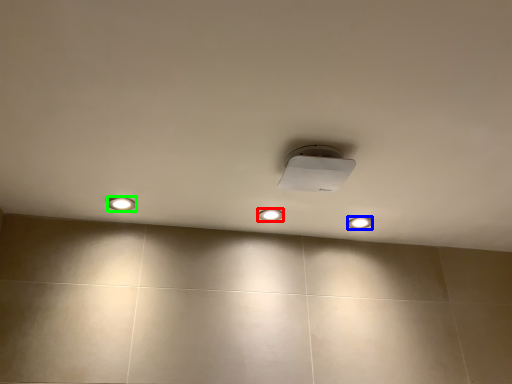
Question: Which object is the closest to the dot (highlighted by a red box)? Choose among these: dot (highlighted by a blue box) or dot (highlighted by a green box).

Choices:
 (A) dot
 (B) dot

Answer: (A)